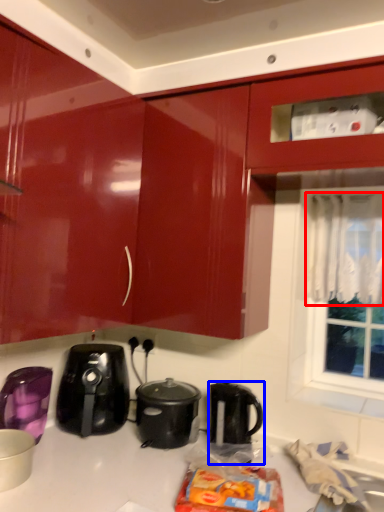
Question: Among these objects, which one is farthest to the camera, curtain (highlighted by a red box) or kettle (highlighted by a blue box)?

Choices:
 (A) curtain
 (B) kettle

Answer: (A)